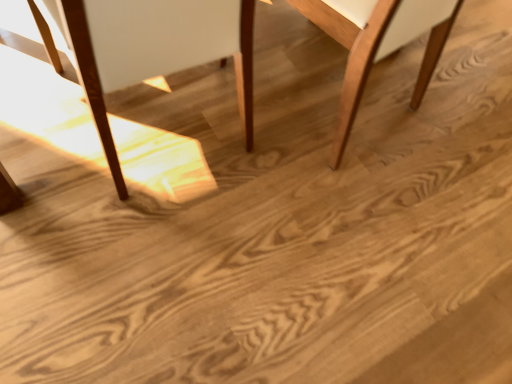
Question: From the image's perspective, relative to light brown wood chair at center, the 2th chair from the left, is matte wood chair at left, placed as the 1th chair when sorted from left to right, above or below?

Choices:
 (A) below
 (B) above

Answer: (A)

Question: Considering the positions of point (111, 52) and point (377, 11), is point (111, 52) closer or farther from the camera than point (377, 11)?

Choices:
 (A) farther
 (B) closer

Answer: (B)

Question: In terms of height, does matte wood chair at left, acting as the 2th chair starting from the right, look taller or shorter compared to light brown wood chair at center, the 2th chair from the left?

Choices:
 (A) tall
 (B) short

Answer: (A)

Question: Is light brown wood chair at center, the 2th chair from the left, taller or shorter than matte wood chair at left, placed as the 1th chair when sorted from left to right?

Choices:
 (A) short
 (B) tall

Answer: (A)

Question: Looking at their shapes, would you say light brown wood chair at center, which is counted as the first chair, starting from the right, is wider or thinner than matte wood chair at left, acting as the 2th chair starting from the right?

Choices:
 (A) thin
 (B) wide

Answer: (A)

Question: From a real-world perspective, relative to matte wood chair at left, placed as the 1th chair when sorted from left to right, is light brown wood chair at center, the 2th chair from the left, vertically above or below?

Choices:
 (A) above
 (B) below

Answer: (B)

Question: In the image, is light brown wood chair at center, which is counted as the first chair, starting from the right, on the left side or the right side of matte wood chair at left, acting as the 2th chair starting from the right?

Choices:
 (A) right
 (B) left

Answer: (A)